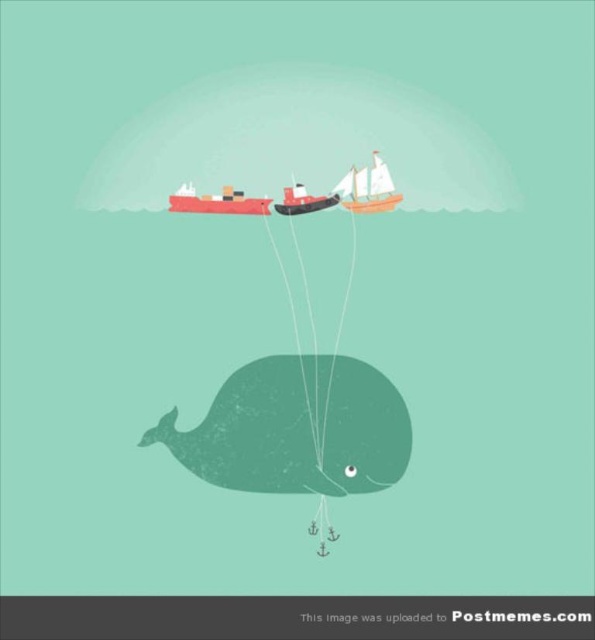
Question: Which object appears farthest from the camera in this image?

Choices:
 (A) smooth wood boat at upper center
 (B) matte red cargo ship at upper center

Answer: (A)

Question: Which object appears farthest from the camera in this image?

Choices:
 (A) wooden sailboat at upper center
 (B) matte red cargo ship at upper center

Answer: (A)

Question: Does wooden sailboat at upper center appear over smooth wood boat at upper center?

Choices:
 (A) yes
 (B) no

Answer: (A)

Question: Can you confirm if wooden sailboat at upper center is positioned below matte red cargo ship at upper center?

Choices:
 (A) yes
 (B) no

Answer: (B)

Question: Which object is the closest to the smooth wood boat at upper center?

Choices:
 (A) matte red cargo ship at upper center
 (B) wooden sailboat at upper center

Answer: (B)

Question: Is wooden sailboat at upper center to the right of matte red cargo ship at upper center from the viewer's perspective?

Choices:
 (A) yes
 (B) no

Answer: (A)